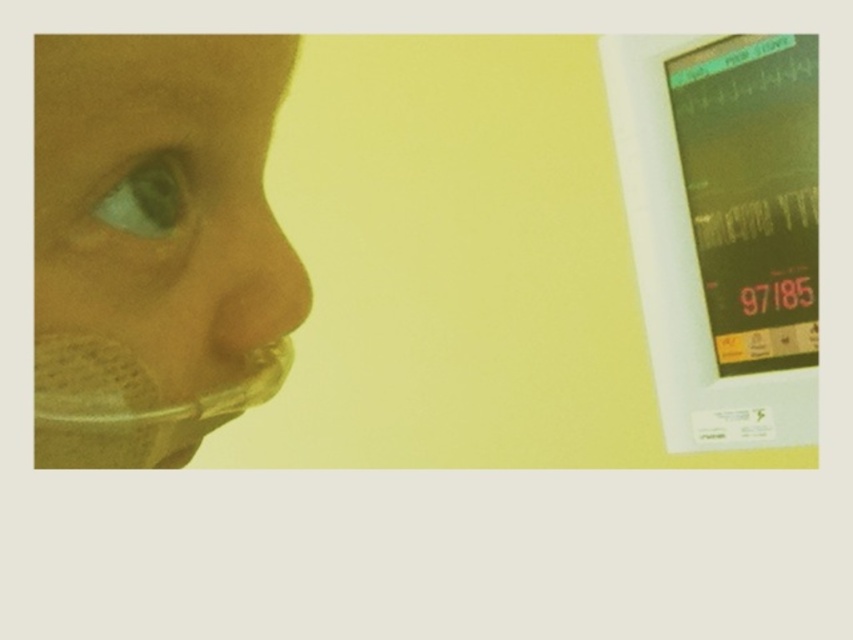
Question: Which object is farther from the camera taking this photo?

Choices:
 (A) translucent plastic nose at center
 (B) green matte eye at center
 (C) matte green monitor at right
 (D) translucent plastic mask at left

Answer: (C)

Question: Considering the real-world distances, which object is closest to the translucent plastic nose at center?

Choices:
 (A) translucent plastic mask at left
 (B) matte green monitor at right

Answer: (A)

Question: Among these points, which one is nearest to the camera?

Choices:
 (A) (167, 420)
 (B) (268, 257)

Answer: (A)

Question: Can you confirm if translucent plastic mask at left is wider than green matte eye at center?

Choices:
 (A) no
 (B) yes

Answer: (B)

Question: Does matte green monitor at right appear on the left side of green matte eye at center?

Choices:
 (A) no
 (B) yes

Answer: (A)

Question: Can you confirm if translucent plastic mask at left is wider than green matte eye at center?

Choices:
 (A) yes
 (B) no

Answer: (A)